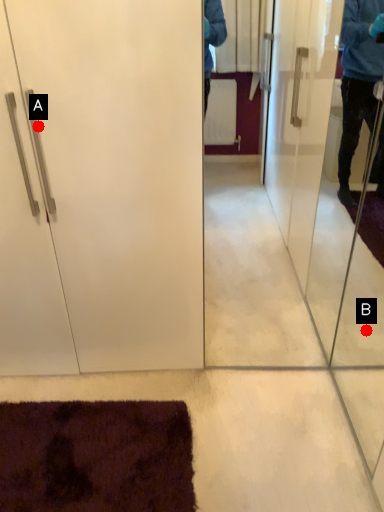
Question: Two points are circled on the image, labeled by A and B beside each circle. Which point is closer to the camera?

Choices:
 (A) A is closer
 (B) B is closer

Answer: (A)